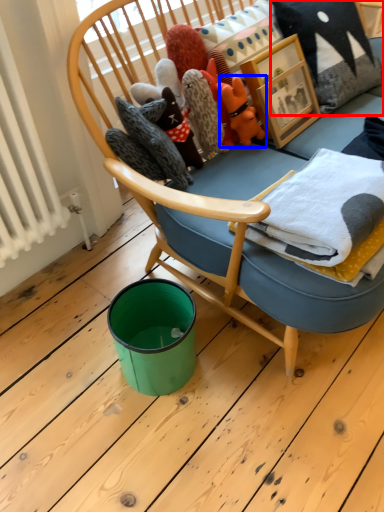
Question: Which object appears farthest to the camera in this image, pillow (highlighted by a red box) or toy (highlighted by a blue box)?

Choices:
 (A) pillow
 (B) toy

Answer: (A)